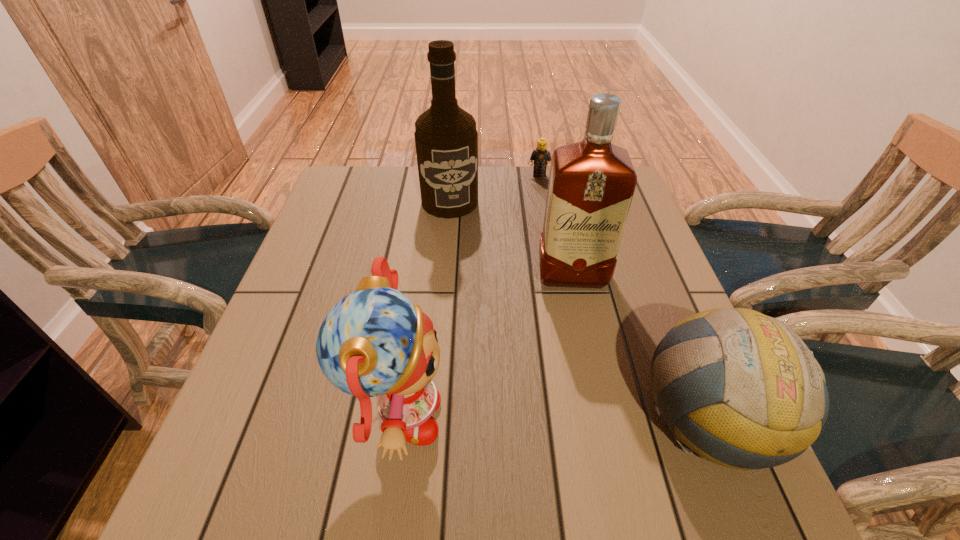
At what (x,y) coordinates should I click in order to perform the action: click on doll. Please return your answer as a coordinate pair (x, y). The height and width of the screenshot is (540, 960). Looking at the image, I should click on (374, 342).

Image resolution: width=960 pixels, height=540 pixels. I want to click on volleyball, so click(751, 395).

The height and width of the screenshot is (540, 960). Find the location of `Lego`. Lego is located at coordinates (541, 155).

Identify the location of the shortest object. This screenshot has height=540, width=960. (541, 155).

Find the location of a particular element. This screenshot has height=540, width=960. alcohol is located at coordinates (446, 139).

In order to click on the third nearest object in this screenshot , I will do `click(591, 184)`.

The width and height of the screenshot is (960, 540). I want to click on free space located 0.090m on the face of the doll, so click(x=497, y=421).

This screenshot has height=540, width=960. In order to click on vacant space located 0.050m on the left of the fourth tallest object in this screenshot , I will do `click(612, 419)`.

Identify the location of free space located 0.130m in front of the shortest object. This screenshot has height=540, width=960. (539, 201).

Where is `vacant space located 0.070m in front of the shortest object`? This screenshot has height=540, width=960. vacant space located 0.070m in front of the shortest object is located at coordinates (539, 190).